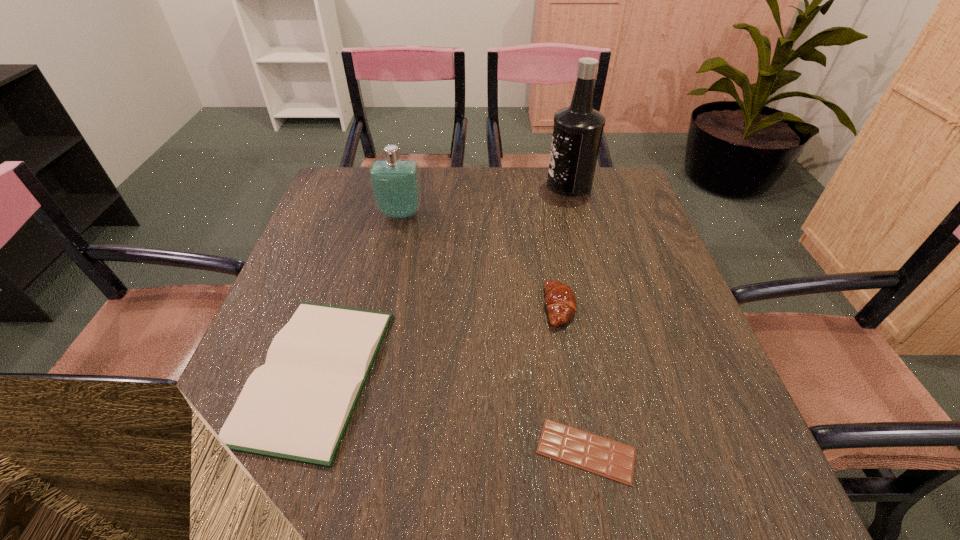
Locate an element on the screen. The image size is (960, 540). the farthest object is located at coordinates (577, 132).

I want to click on liquor, so click(x=577, y=132).

What are the coordinates of `perfume` in the screenshot? It's located at (395, 183).

At what (x,y) coordinates should I click in order to perform the action: click on the second tallest object. Please return your answer as a coordinate pair (x, y). Image resolution: width=960 pixels, height=540 pixels. Looking at the image, I should click on (395, 183).

Where is `crescent roll`? Image resolution: width=960 pixels, height=540 pixels. crescent roll is located at coordinates (560, 300).

Locate an element on the screen. The height and width of the screenshot is (540, 960). hardback book is located at coordinates (297, 406).

Image resolution: width=960 pixels, height=540 pixels. Identify the location of the shortest object. (590, 452).

Where is `blank space located on the front label of the farthest object`? blank space located on the front label of the farthest object is located at coordinates (421, 185).

Locate an element on the screen. Image resolution: width=960 pixels, height=540 pixels. free space located on the front label of the farthest object is located at coordinates (523, 185).

In order to click on vacant position located 0.180m on the front label of the farthest object in this screenshot , I will do `click(487, 185)`.